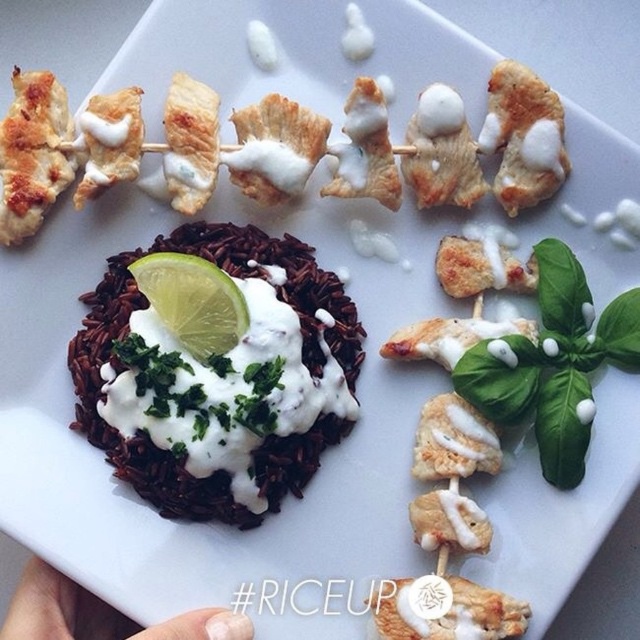
Looking at this image, is dark brown rice at center wider than white matte plate at upper center?

Correct, the width of dark brown rice at center exceeds that of white matte plate at upper center.

Who is more distant from viewer, (109, 449) or (125, 632)?

Point (109, 449)

Identify the location of dark brown rice at center. The height and width of the screenshot is (640, 640). (189, 413).

Is point (576, 262) closer to camera compared to point (500, 65)?

Yes, it is in front of point (500, 65).

Who is lower down, green leafy basil at lower right or golden-brown crispy chicken at upper right?

green leafy basil at lower right

This screenshot has width=640, height=640. What are the coordinates of `green leafy basil at lower right` in the screenshot? It's located at (552, 364).

Can you confirm if dark brown rice at center is positioned to the left of green leafy basil at lower right?

Yes, dark brown rice at center is to the left of green leafy basil at lower right.

What do you see at coordinates (189, 413) in the screenshot?
I see `dark brown rice at center` at bounding box center [189, 413].

This screenshot has width=640, height=640. Describe the element at coordinates (189, 413) in the screenshot. I see `dark brown rice at center` at that location.

Where is `dark brown rice at center`? dark brown rice at center is located at coordinates [x=189, y=413].